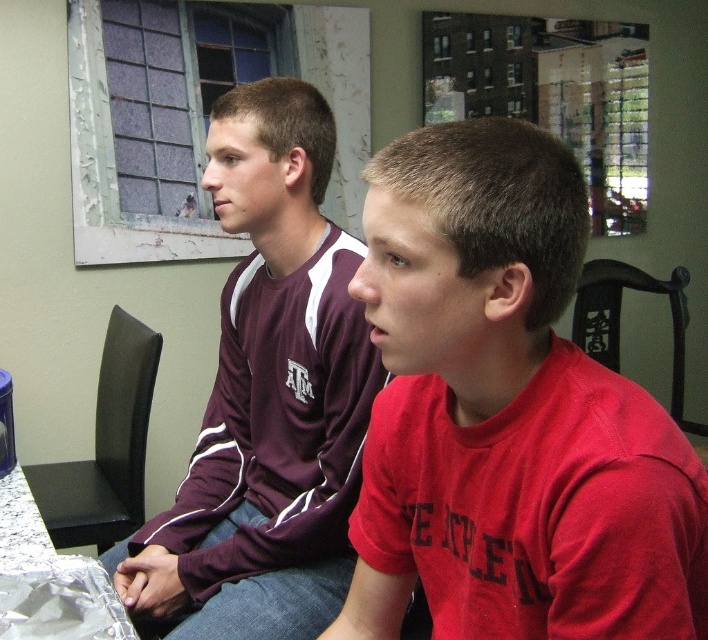
Measure the distance from red matte shirt at center to maroon jersey at center.

red matte shirt at center is 19.64 inches away from maroon jersey at center.

Does red matte shirt at center appear under maroon jersey at center?

Yes, red matte shirt at center is below maroon jersey at center.

This screenshot has width=708, height=640. I want to click on red matte shirt at center, so pos(506,413).

You are a GUI agent. You are given a task and a screenshot of the screen. Output one action in this format:
    pyautogui.click(x=<x>, y=<y>)
    Task: Click on the red matte shirt at center
    This screenshot has height=640, width=708.
    Given the screenshot: What is the action you would take?
    pyautogui.click(x=506, y=413)